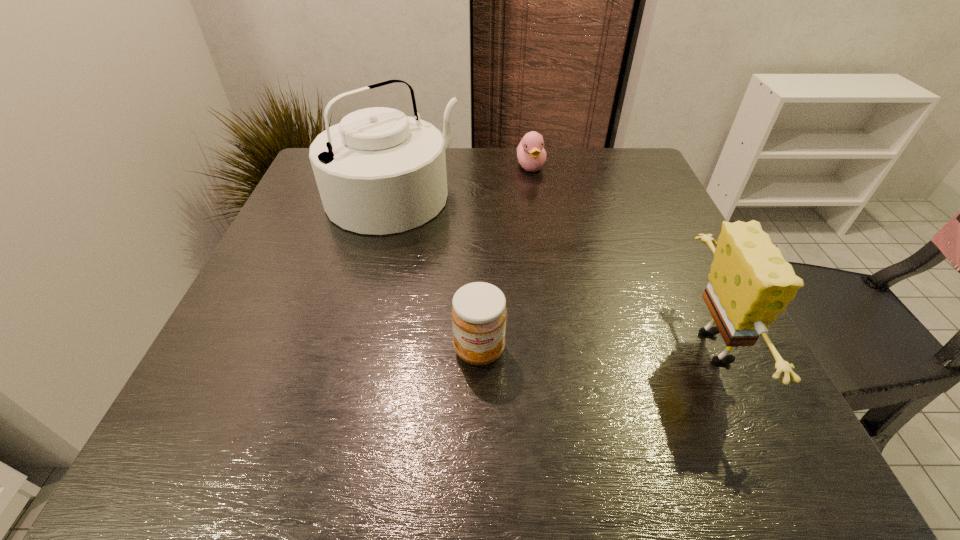
The width and height of the screenshot is (960, 540). I want to click on object located at the near right corner, so click(750, 283).

At what (x,y) coordinates should I click in order to perform the action: click on vacant region at the far edge of the desktop. Please return your answer as a coordinate pair (x, y). Looking at the image, I should click on (550, 186).

The height and width of the screenshot is (540, 960). In order to click on free space at the left edge of the desktop in this screenshot , I will do `click(328, 239)`.

At what (x,y) coordinates should I click in order to perform the action: click on vacant area at the right edge. Please return your answer as a coordinate pair (x, y). This screenshot has height=540, width=960. Looking at the image, I should click on (608, 204).

Image resolution: width=960 pixels, height=540 pixels. In the image, there is a desktop. What are the coordinates of `vacant space at the far right corner` in the screenshot? It's located at (634, 151).

This screenshot has width=960, height=540. What are the coordinates of `free space between the sponge and the tallest object` in the screenshot? It's located at (556, 273).

Identify the location of vacant area between the jam and the sponge. (599, 348).

Where is `free space between the sponge and the second object from right to left`? free space between the sponge and the second object from right to left is located at coordinates (625, 257).

Locate an element on the screen. This screenshot has width=960, height=540. vacant point located between the duckling and the second tallest object is located at coordinates (625, 257).

Find the location of `vacant area that lies between the leftmost object and the jam`. vacant area that lies between the leftmost object and the jam is located at coordinates (436, 274).